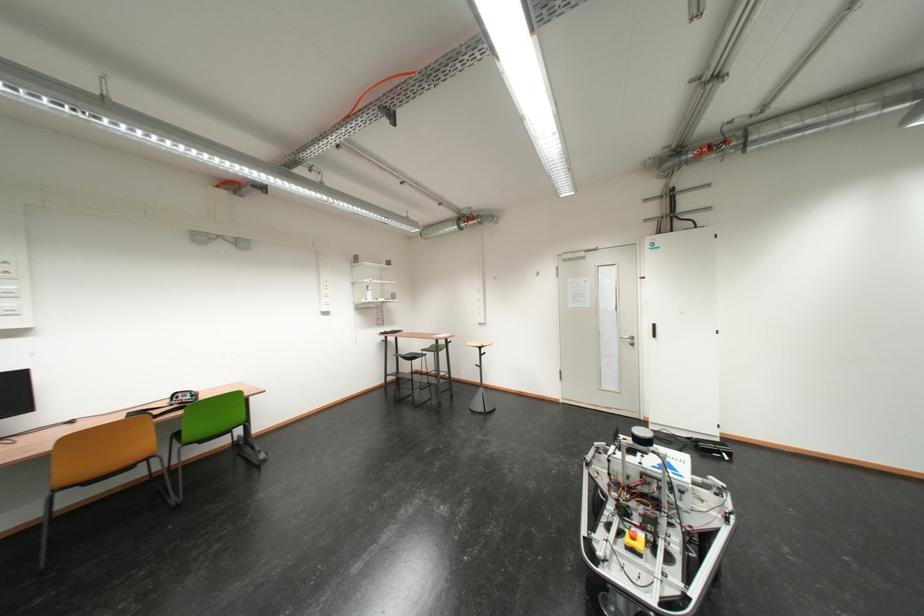
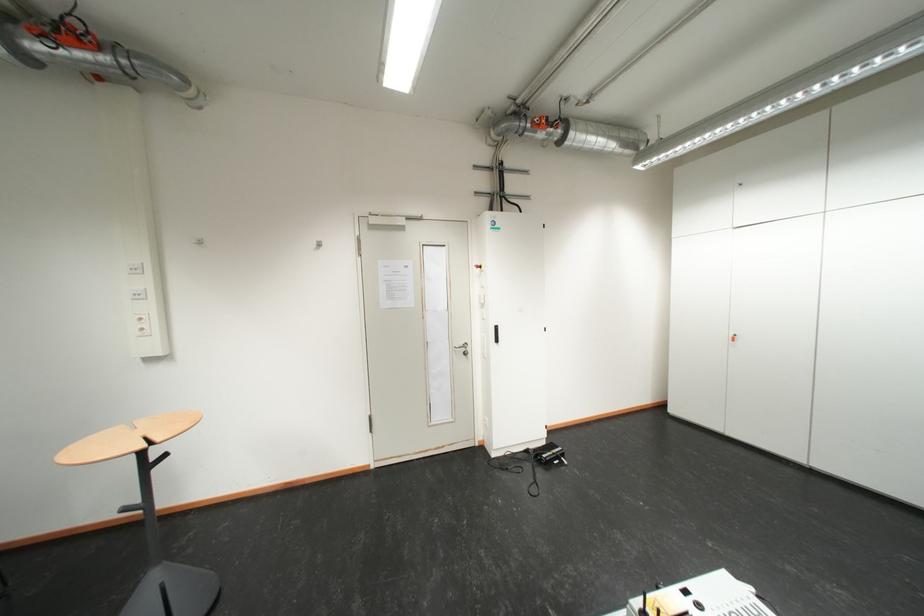
Find the pixel in the second image that matches the point at 665,328 in the first image.

(507, 330)